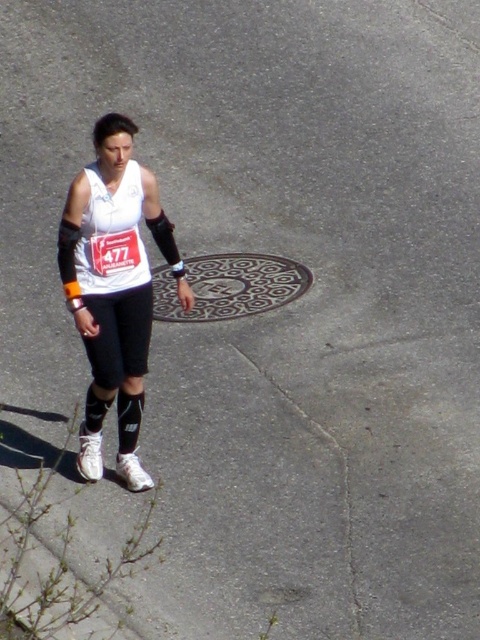
Consider the image. Which is more to the right, white matte tank top at center or patterned metal manhole cover at center?

Positioned to the right is patterned metal manhole cover at center.

Is white matte tank top at center bigger than patterned metal manhole cover at center?

Correct, white matte tank top at center is larger in size than patterned metal manhole cover at center.

Is point (147, 314) less distant than point (248, 273)?

Yes, point (147, 314) is in front of point (248, 273).

I want to click on white matte tank top at center, so click(113, 289).